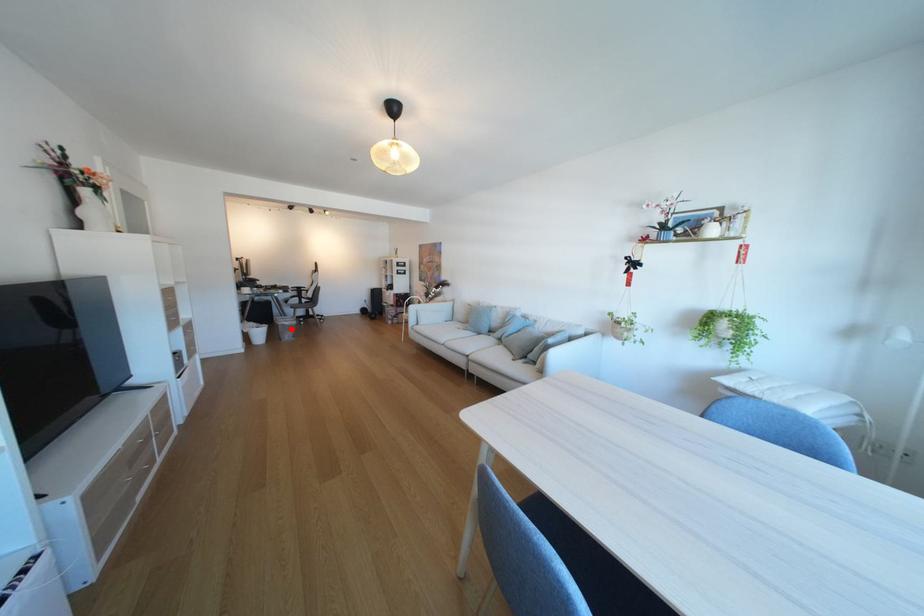
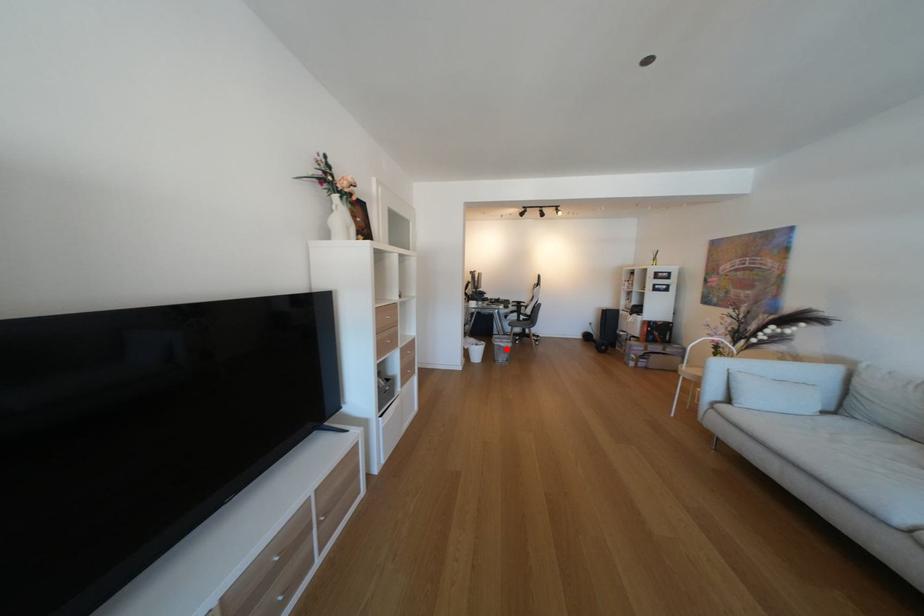
I am providing you with two images of the same scene from different viewpoints. A red point is marked on the first image and another point is marked on the second image. Does the point marked in image1 correspond to the same location as the one in image2?

Yes